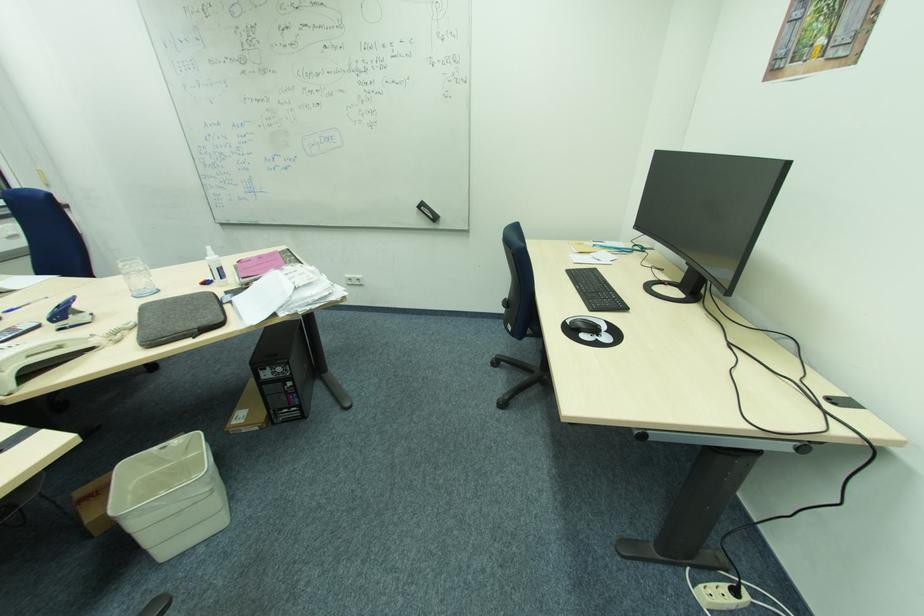
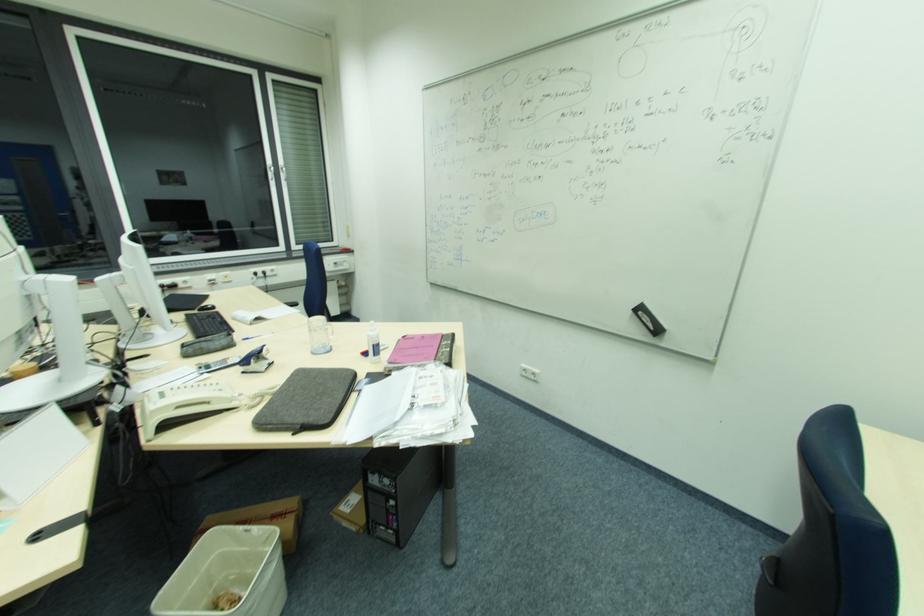
In the second image, find the point that corresponds to [157,292] in the first image.

(330, 351)